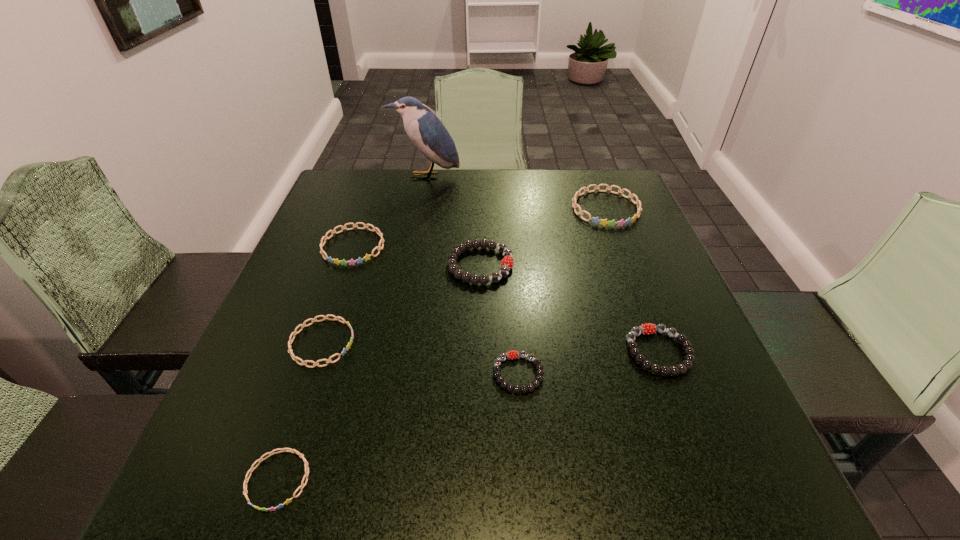
The height and width of the screenshot is (540, 960). Identify the location of the farthest object. (426, 131).

Identify the location of bird. (426, 131).

At what (x,y) coordinates should I click in order to perform the action: click on the biggest blue bracelet. Please return your answer as a coordinate pair (x, y). This screenshot has width=960, height=540. Looking at the image, I should click on (604, 222).

Where is `the farthest black bracelet`? the farthest black bracelet is located at coordinates (507, 262).

Locate an element on the screen. the third smallest blue bracelet is located at coordinates (351, 262).

This screenshot has height=540, width=960. Identify the location of the rightmost black bracelet. (649, 328).

The image size is (960, 540). I want to click on the third biggest blue bracelet, so click(303, 325).

Locate an element on the screen. the smallest black bracelet is located at coordinates (513, 354).

Image resolution: width=960 pixels, height=540 pixels. I want to click on the nearest object, so click(x=272, y=452).

Find the location of `the shortest bracelet`. the shortest bracelet is located at coordinates (272, 452).